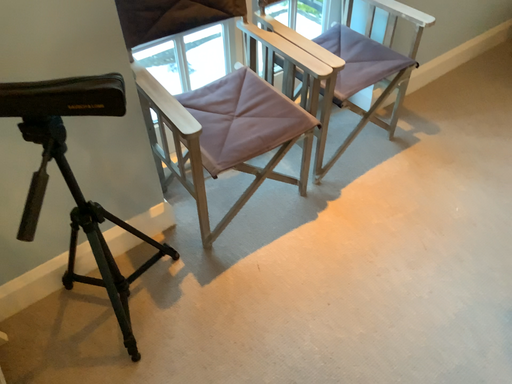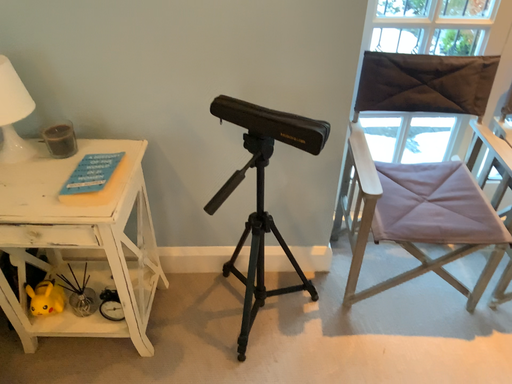
Question: How did the camera likely rotate when shooting the video?

Choices:
 (A) rotated upward
 (B) rotated downward

Answer: (A)